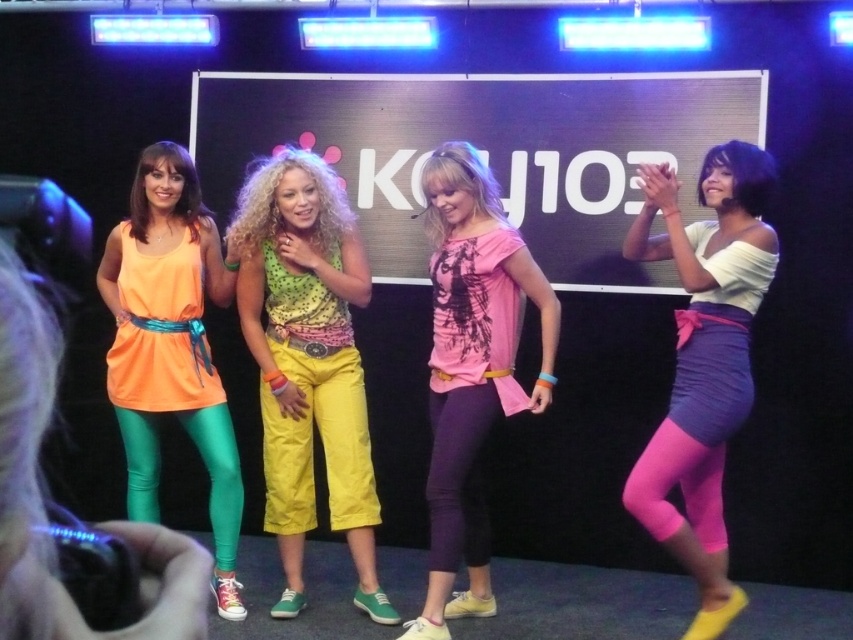
Question: Which object is the farthest from the matte white top at right?

Choices:
 (A) matte orange dress at left
 (B) polka dot fabric top at center
 (C) pink matte t-shirt at center

Answer: (A)

Question: Is polka dot fabric top at center to the left of matte white top at right from the viewer's perspective?

Choices:
 (A) no
 (B) yes

Answer: (B)

Question: Is the position of polka dot fabric top at center less distant than that of matte orange dress at left?

Choices:
 (A) no
 (B) yes

Answer: (A)

Question: Among these points, which one is nearest to the camera?

Choices:
 (A) pyautogui.click(x=752, y=150)
 (B) pyautogui.click(x=482, y=371)
 (C) pyautogui.click(x=277, y=252)
 (D) pyautogui.click(x=129, y=492)

Answer: (A)

Question: Is polka dot fabric top at center wider than pink matte t-shirt at center?

Choices:
 (A) yes
 (B) no

Answer: (A)

Question: Which point is closer to the camera?

Choices:
 (A) pink matte t-shirt at center
 (B) polka dot fabric top at center
 (C) matte white top at right

Answer: (C)